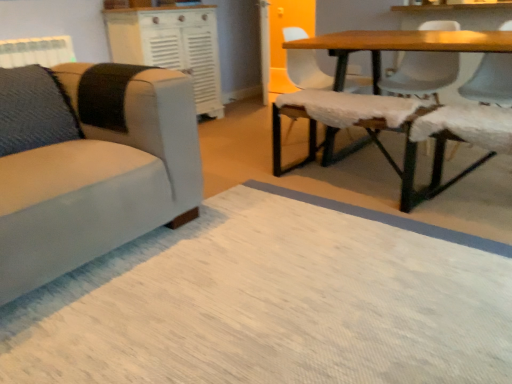
Question: Could smooth white chair at upper right, which is the 5th chair in left-to-right order, be considered to be inside white textured radiator at upper left?

Choices:
 (A) no
 (B) yes

Answer: (A)

Question: Can you confirm if white textured radiator at upper left is positioned to the left of smooth white chair at upper right, which is the 5th chair in left-to-right order?

Choices:
 (A) no
 (B) yes

Answer: (B)

Question: Is white textured radiator at upper left turned away from smooth white chair at upper right, which is the 5th chair in left-to-right order?

Choices:
 (A) yes
 (B) no

Answer: (B)

Question: Can you confirm if white textured radiator at upper left is wider than smooth white chair at upper right, which is the 5th chair in left-to-right order?

Choices:
 (A) yes
 (B) no

Answer: (B)

Question: Does white textured radiator at upper left come behind smooth white chair at upper right, which is the 5th chair in left-to-right order?

Choices:
 (A) no
 (B) yes

Answer: (B)

Question: Is white textured radiator at upper left positioned beyond the bounds of smooth white chair at upper right, which is the 5th chair in left-to-right order?

Choices:
 (A) yes
 (B) no

Answer: (A)

Question: Does white fabric chair at upper right, which is the 4th chair from right to left, appear on the right side of fuzzy fabric swivel chair at center?

Choices:
 (A) no
 (B) yes

Answer: (A)

Question: Is white fabric chair at upper right, which is the 4th chair from right to left, smaller than fuzzy fabric swivel chair at center?

Choices:
 (A) yes
 (B) no

Answer: (B)

Question: Is the depth of white fabric chair at upper right, which is the 4th chair from right to left, greater than that of fuzzy fabric swivel chair at center?

Choices:
 (A) yes
 (B) no

Answer: (A)

Question: From the image's perspective, is white fabric chair at upper right, which is the 4th chair from right to left, beneath fuzzy fabric swivel chair at center?

Choices:
 (A) no
 (B) yes

Answer: (A)

Question: Is white fabric chair at upper right, which appears as the 2th chair when viewed from the left, positioned beyond the bounds of fuzzy fabric swivel chair at center?

Choices:
 (A) yes
 (B) no

Answer: (A)

Question: Is white fabric chair at upper right, which is the 4th chair from right to left, oriented away from fuzzy fabric swivel chair at center?

Choices:
 (A) no
 (B) yes

Answer: (A)

Question: Can you confirm if fuzzy fabric swivel chair at center is shorter than smooth white chair at upper right, which is the 1th chair in right-to-left order?

Choices:
 (A) no
 (B) yes

Answer: (B)